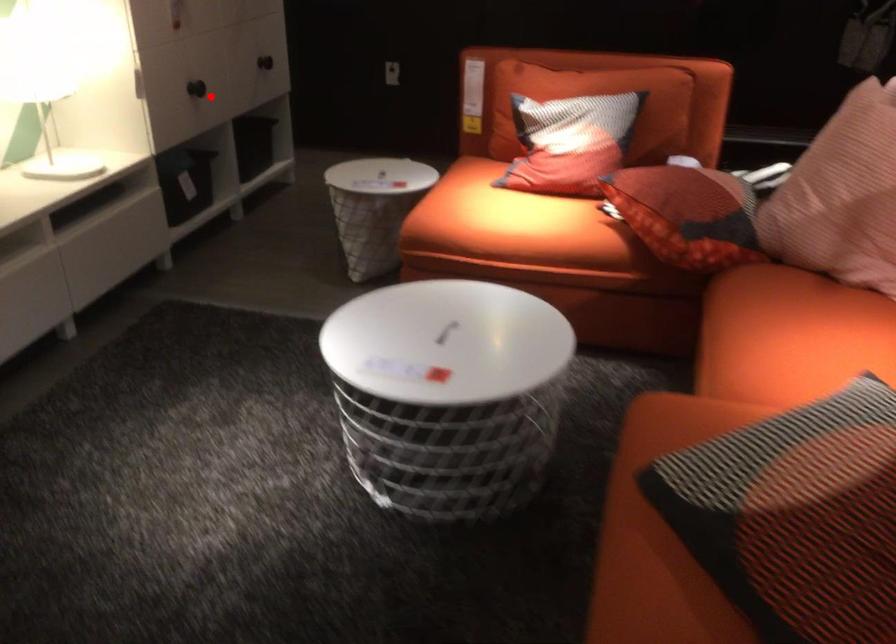
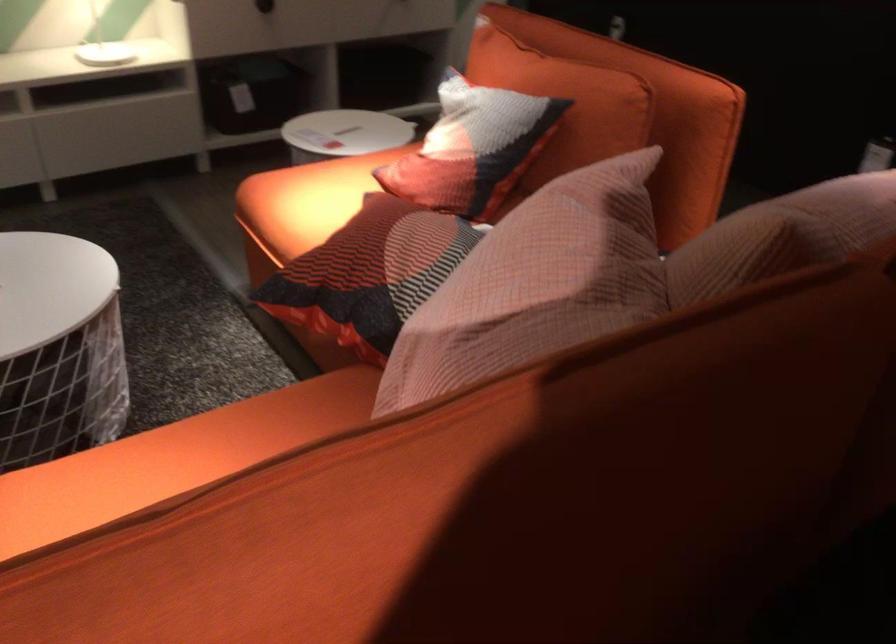
Question: I am providing you with two images of the same scene from different viewpoints. A red point is marked on the first image. Can you still see the location of the red point in image 2?

Choices:
 (A) Yes
 (B) No

Answer: (A)